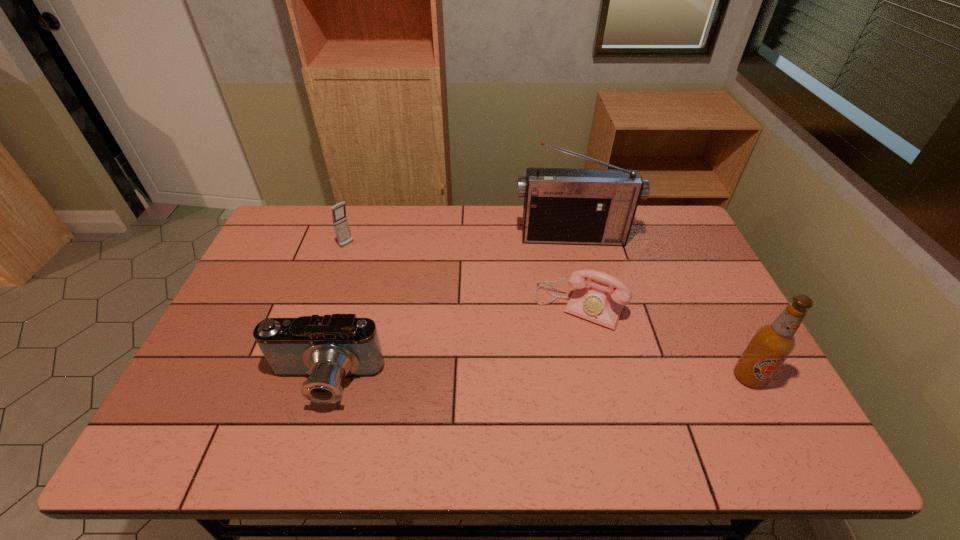
Locate an element on the screen. This screenshot has height=540, width=960. vacant space on the desktop that is between the camcorder and the rightmost object and is positioned on the front-facing side of the radio receiver is located at coordinates (596, 379).

Where is `vacant spot on the desktop that is between the camcorder and the second tallest object and is positioned on the front-facing side of the cellular telephone`? Image resolution: width=960 pixels, height=540 pixels. vacant spot on the desktop that is between the camcorder and the second tallest object and is positioned on the front-facing side of the cellular telephone is located at coordinates (520, 380).

Where is `vacant space on the desktop that is between the camcorder and the beer bottle and is positioned on the dial of the telephone`? vacant space on the desktop that is between the camcorder and the beer bottle and is positioned on the dial of the telephone is located at coordinates (543, 380).